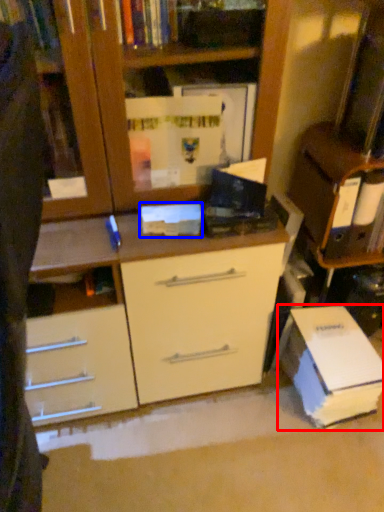
Question: Which object appears farthest to the camera in this image, paperback book (highlighted by a red box) or paperback book (highlighted by a blue box)?

Choices:
 (A) paperback book
 (B) paperback book

Answer: (A)